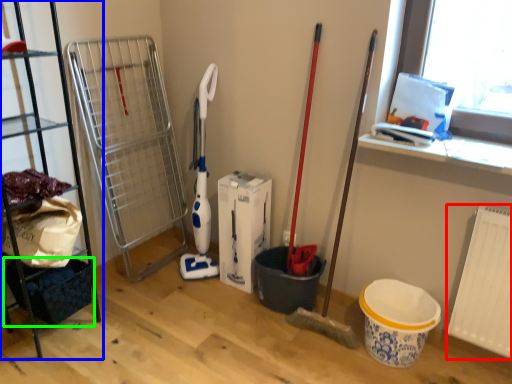
Question: Which object is positioned farthest from radiator (highlighted by a red box)? Select from shelf (highlighted by a blue box) and basket (highlighted by a green box).

Choices:
 (A) shelf
 (B) basket

Answer: (A)